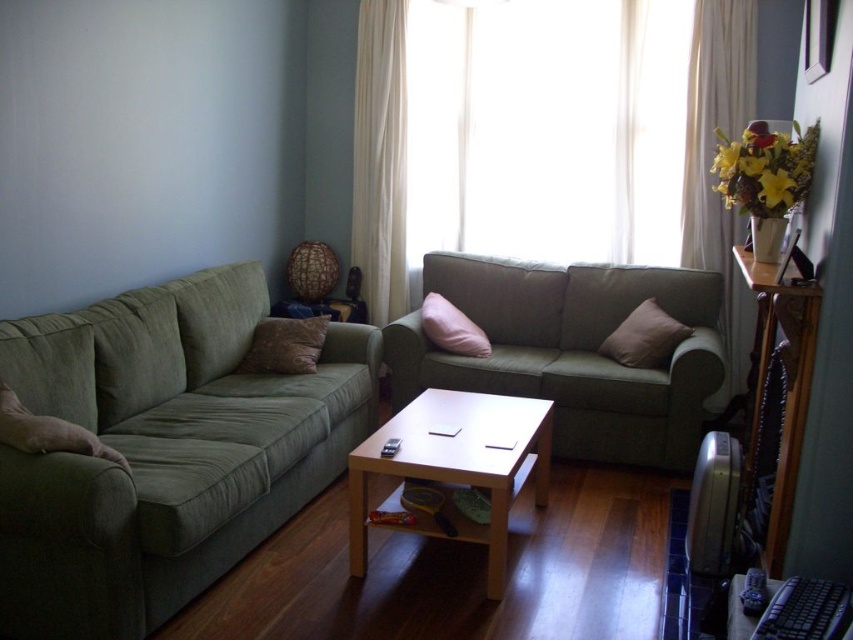
Question: Is white sheer curtain at upper right behind pink fabric pillow at center?

Choices:
 (A) yes
 (B) no

Answer: (B)

Question: Which of the following is the closest to the observer?

Choices:
 (A) (616, 333)
 (B) (285, 340)
 (C) (706, 196)
 (D) (491, 538)

Answer: (D)

Question: Which of these objects is positioned closest to the brown suede pillow at center?

Choices:
 (A) white sheer curtain at upper center
 (B) white sheer curtain at upper right

Answer: (A)

Question: Among these points, which one is nearest to the camera?

Choices:
 (A) (172, 364)
 (B) (776, 472)
 (C) (300, 346)
 (D) (646, 321)

Answer: (B)

Question: Observing the image, what is the correct spatial positioning of brown suede pillow at center in reference to pink fabric pillow at center?

Choices:
 (A) left
 (B) right

Answer: (A)

Question: Is soft pink cushion at center in front of pink fabric pillow at center?

Choices:
 (A) no
 (B) yes

Answer: (B)